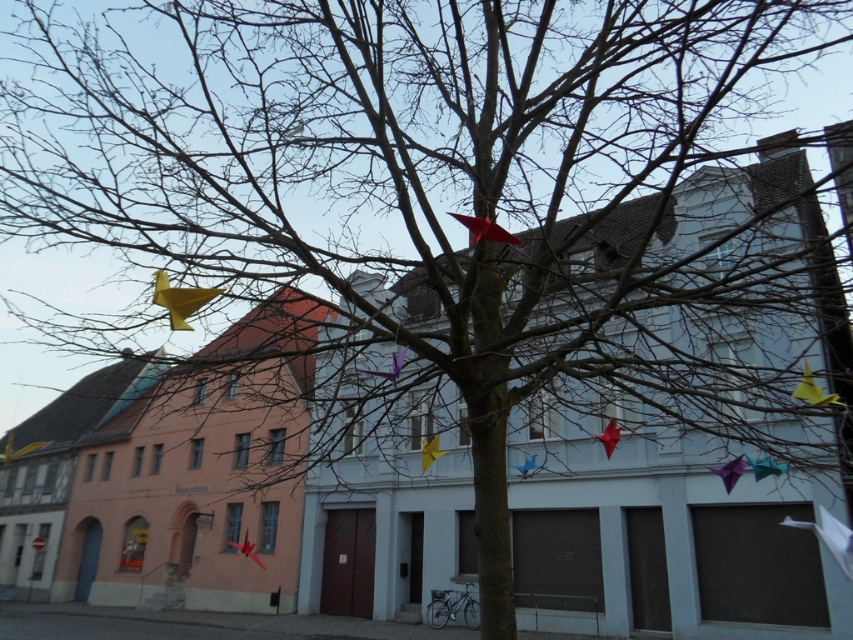
You are a photographer planning to capture both the matte red flag at center and the blue glossy kite at center in a single shot. Given their sizes, which object will appear bigger in the photo?

The matte red flag at center will appear bigger in the photo because it is larger in size than the blue glossy kite at center.

You are a delivery person who needs to place a package near the white paper flag at lower right and the yellow paper flag at right. Which flag should you place the package closer to if you want it to be more visible from the street?

The white paper flag at lower right is much taller than the yellow paper flag at right, so placing the package near the white paper flag at lower right would make it more visible from the street due to its height.

Based on the photo, you are a photographer trying to capture both the matte red flag at center and the blue glossy kite at center in a single shot. Since both are at the center, which one will appear closer to the camera in the photo?

The matte red flag at center is positioned over blue glossy kite at center, so the matte red flag at center will appear closer to the camera in the photo.